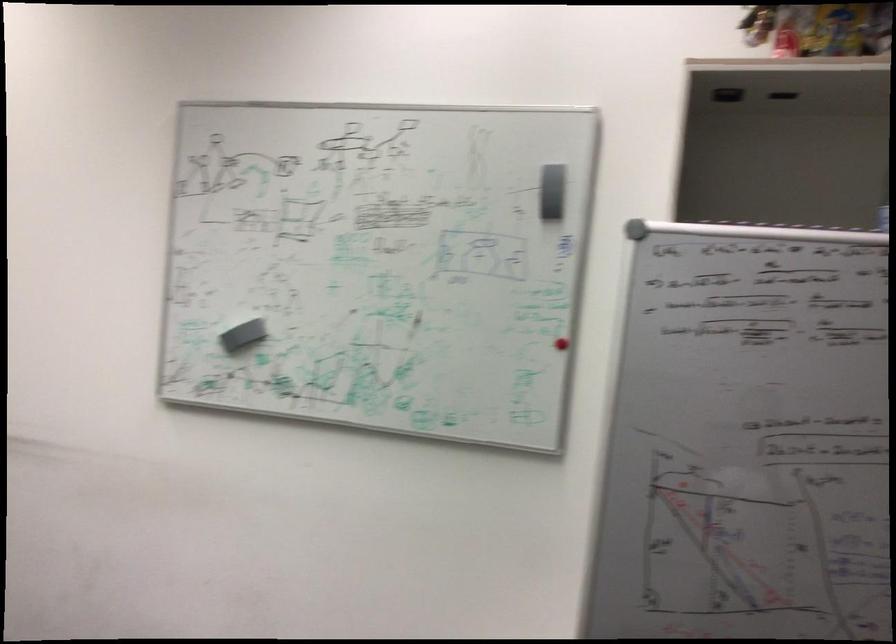
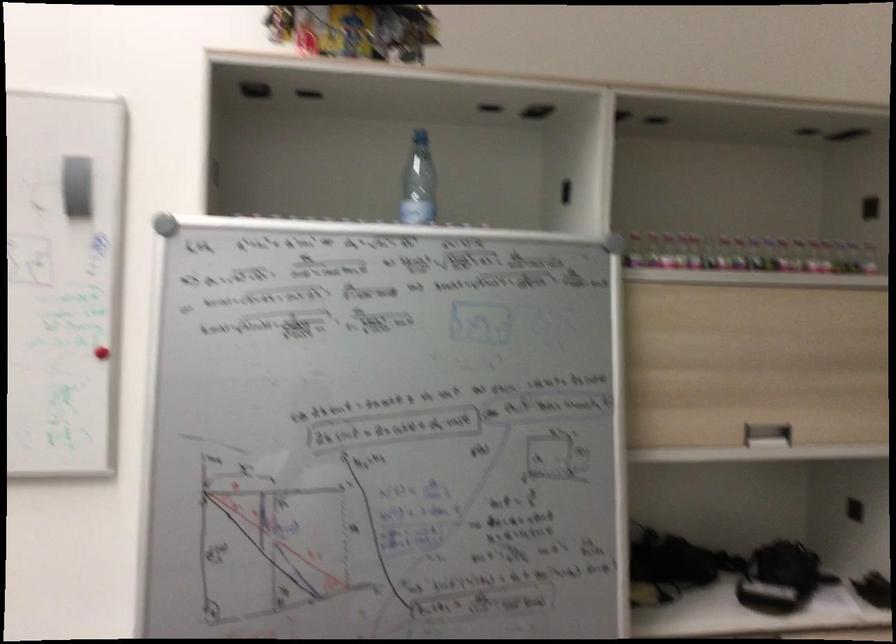
Question: The images are taken continuously from a first-person perspective. In which direction is your viewpoint rotating?

Choices:
 (A) Left
 (B) Right
 (C) Up
 (D) Down

Answer: (B)